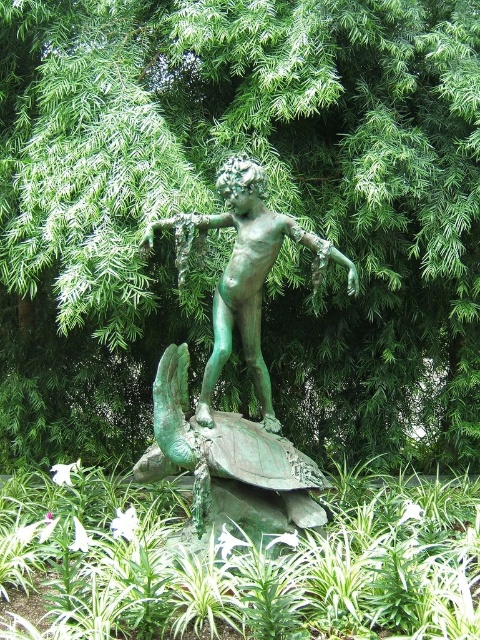
From the picture: Who is taller, green textured statue at center or green patina statue at center?

green textured statue at center

Can you confirm if green textured statue at center is smaller than green patina statue at center?

No, green textured statue at center is not smaller than green patina statue at center.

The width and height of the screenshot is (480, 640). I want to click on green textured statue at center, so click(x=230, y=230).

Can you confirm if green patina tortoise at center is smaller than green patina statue at center?

Yes, green patina tortoise at center is smaller than green patina statue at center.

In the scene shown: Is green patina tortoise at center positioned at the back of green patina statue at center?

That is False.

Identify the location of green patina tortoise at center. (228, 465).

This screenshot has width=480, height=640. What are the coordinates of `green patina tortoise at center` in the screenshot? It's located at (228, 465).

Based on the photo, is green patina turtle at center taller than green patina tortoise at center?

No, green patina turtle at center is not taller than green patina tortoise at center.

Based on the photo, does green patina turtle at center appear over green patina tortoise at center?

Actually, green patina turtle at center is below green patina tortoise at center.

Describe the element at coordinates (242, 563) in the screenshot. This screenshot has height=640, width=480. I see `green patina turtle at center` at that location.

Identify the location of green patina turtle at center. (242, 563).